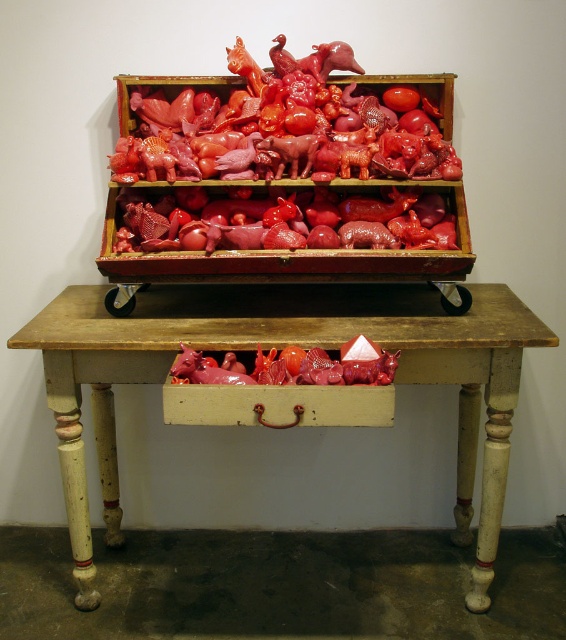
You are standing in front of the rustic wooden table and want to place a new item exactly at point (284, 184). According to the image, where will this point be located?

The point (284, 184) is on the glossy plastic box at center, so placing the item there would position it on top of the glossy plastic box at center.

Looking at this image, you are standing in front of the rustic wooden table and want to place a small object on the table. You have two points to choose from, point (327, 355) and point (392, 106). Which point is closer to you?

Point (327, 355) is closer to the viewer than point (392, 106), so you should place the object there.